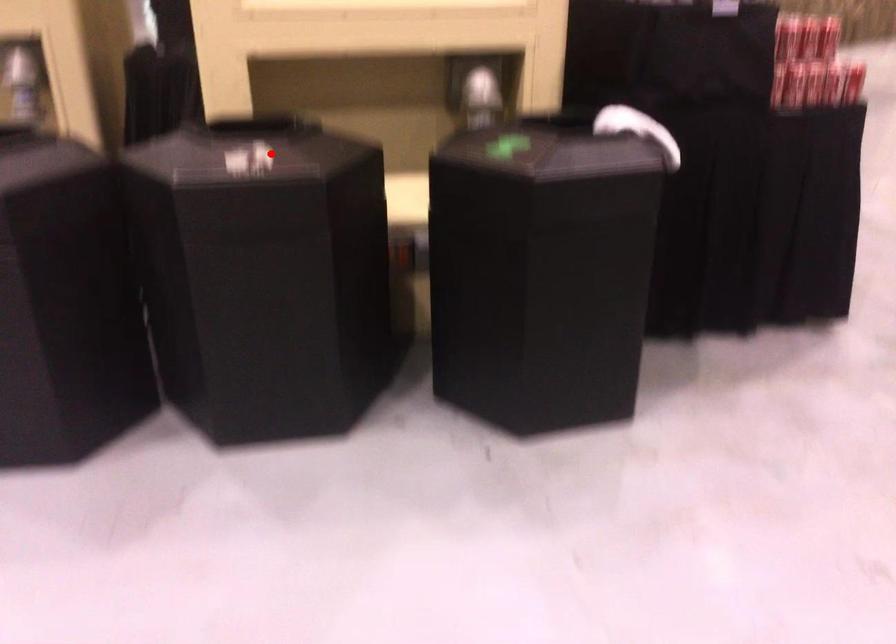
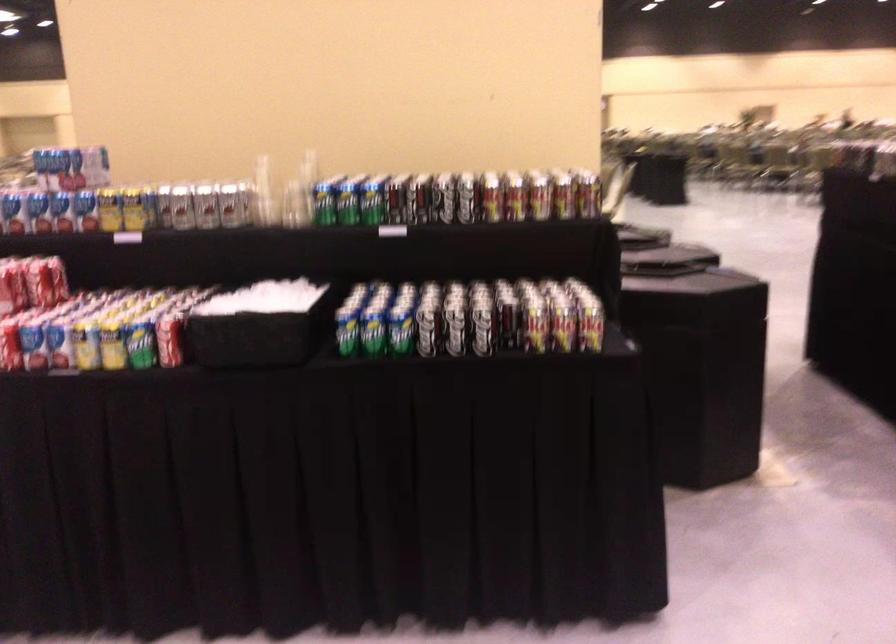
Question: I am providing you with two images of the same scene from different viewpoints. A red point is marked on the first image. Is the red point's position out of view in image 2?

Choices:
 (A) Yes
 (B) No

Answer: (A)